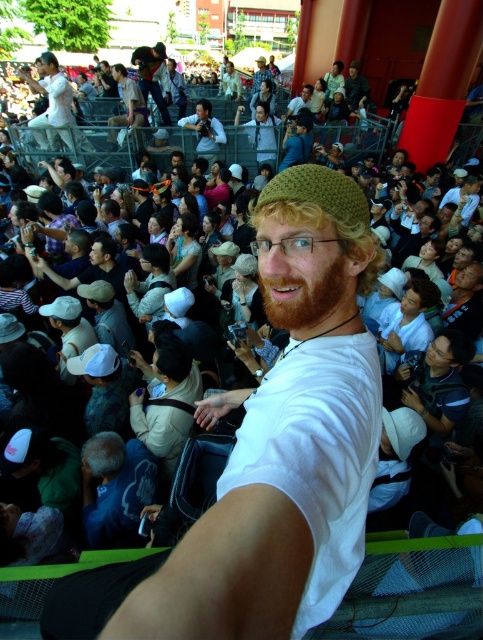
What is the object located at the coordinates point (x=154, y=76) in the image?

The point (x=154, y=76) indicates a matte black camera at upper center.